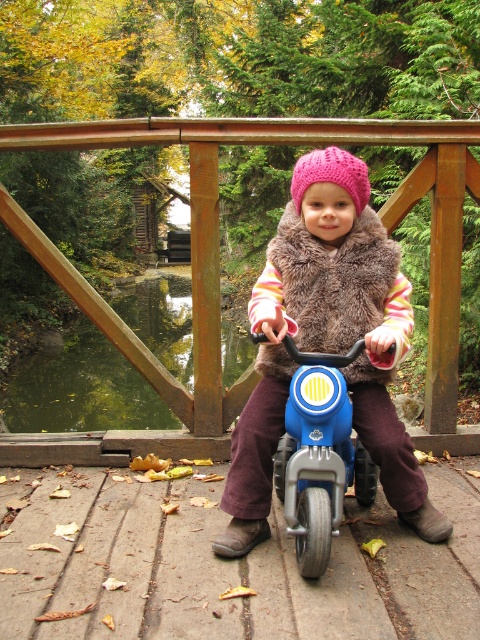
Based on the scene description, what object is located at the coordinates point (x=218, y=273)?

The point (x=218, y=273) corresponds to the wooden rail at center.

You are a parent watching your child riding the tricycle on the bridge. You notice the wooden rail at center and the matte pink knit hat at center. Which object is taller?

The wooden rail at center is much taller than the matte pink knit hat at center.